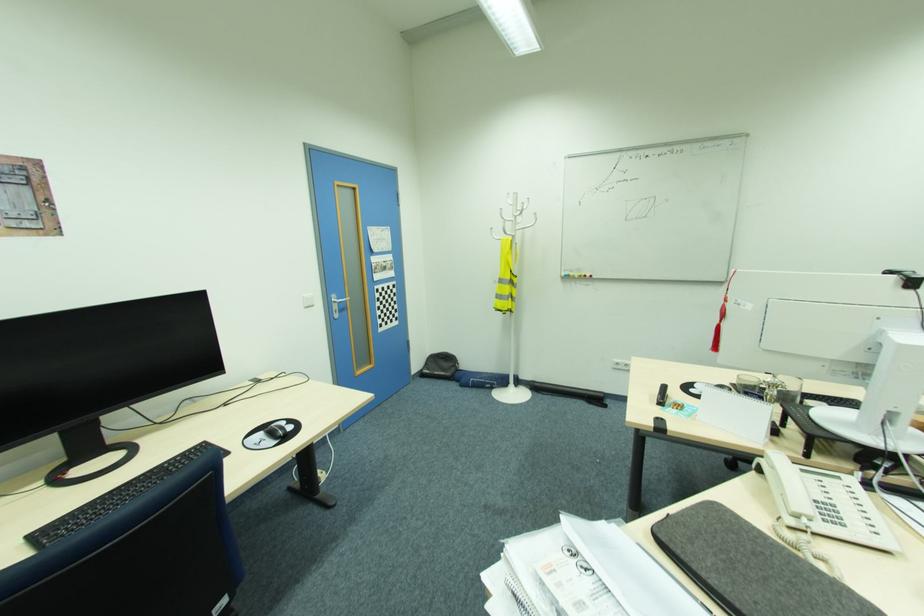
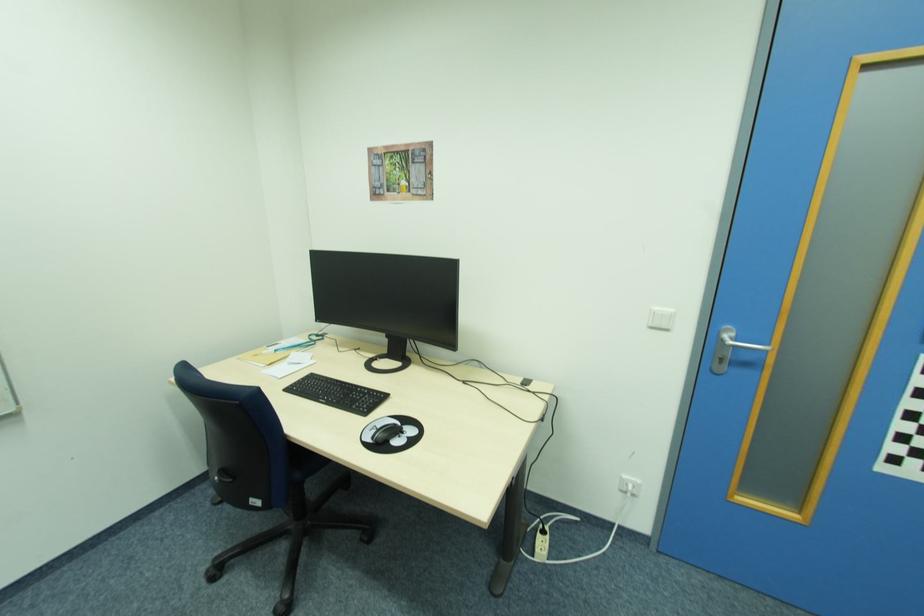
Locate, in the second image, the point that corresponds to (349,301) in the first image.

(768, 350)